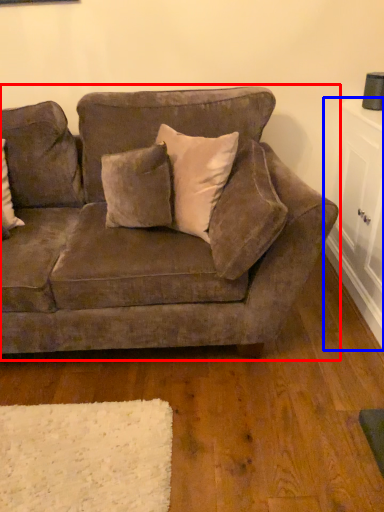
Question: Which object appears farthest to the camera in this image, studio couch (highlighted by a red box) or table (highlighted by a blue box)?

Choices:
 (A) studio couch
 (B) table

Answer: (B)